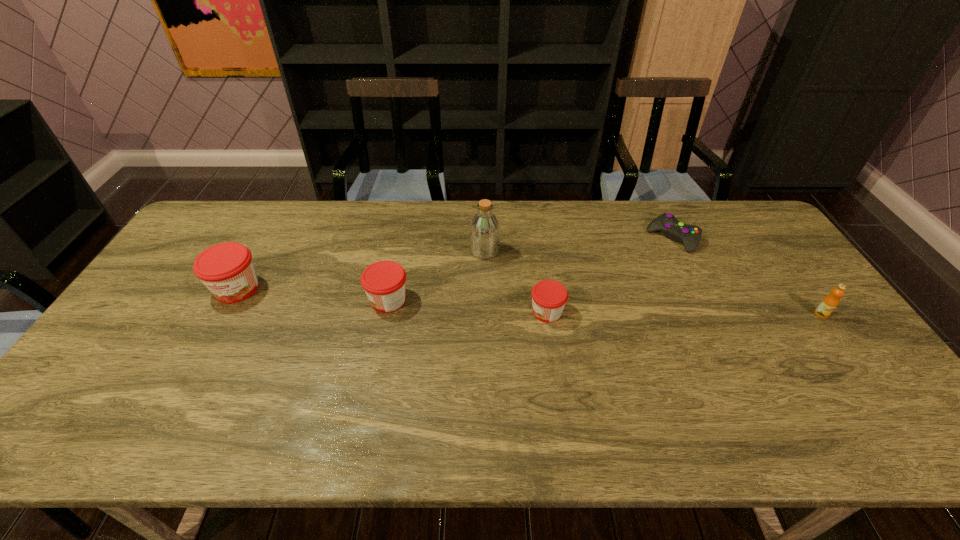
The image size is (960, 540). I want to click on the rightmost object, so click(829, 303).

Image resolution: width=960 pixels, height=540 pixels. Identify the location of vacant space located 0.290m on the label side of the tallest jam. (176, 399).

Where is `vacant point located 0.120m on the label side of the second jam from right to left`? The width and height of the screenshot is (960, 540). vacant point located 0.120m on the label side of the second jam from right to left is located at coordinates (324, 300).

Where is `vacant area situated on the label side of the second jam from right to left`? The image size is (960, 540). vacant area situated on the label side of the second jam from right to left is located at coordinates (238, 300).

Locate an element on the screen. This screenshot has width=960, height=540. blank space located 0.050m on the label side of the second jam from right to left is located at coordinates (349, 300).

At what (x,y) coordinates should I click in order to perform the action: click on vacant space located 0.150m on the label side of the shortest jam. Please return your answer as a coordinate pair (x, y). The width and height of the screenshot is (960, 540). Looking at the image, I should click on (475, 312).

Identify the location of free space located 0.240m on the label side of the shortest jam. [444, 312].

Locate an element on the screen. The image size is (960, 540). free space located on the label side of the shortest jam is located at coordinates (404, 312).

At what (x,y) coordinates should I click in order to perform the action: click on blank area located 0.050m on the front of the second object from right to left. Please return your answer as a coordinate pair (x, y). The width and height of the screenshot is (960, 540). Looking at the image, I should click on (685, 265).

The image size is (960, 540). Identify the location of free space located on the left of the tallest object. (383, 251).